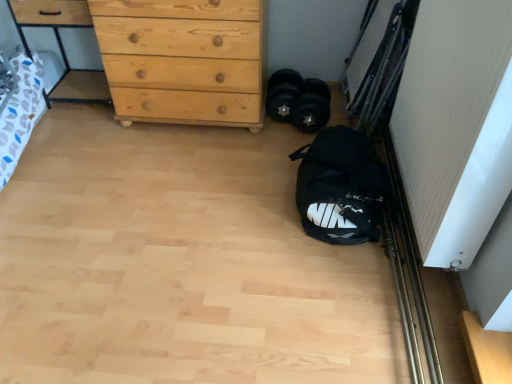
This screenshot has width=512, height=384. Find the location of `free space in front of natural wood chest of drawers at upper left`. free space in front of natural wood chest of drawers at upper left is located at coordinates (169, 173).